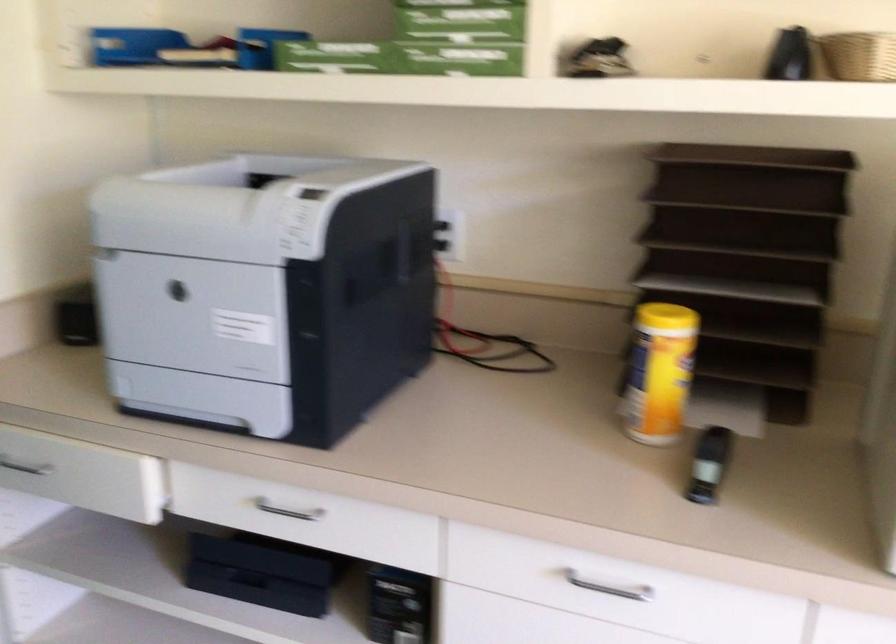
This screenshot has height=644, width=896. Describe the element at coordinates (194, 315) in the screenshot. I see `the printer paper tray` at that location.